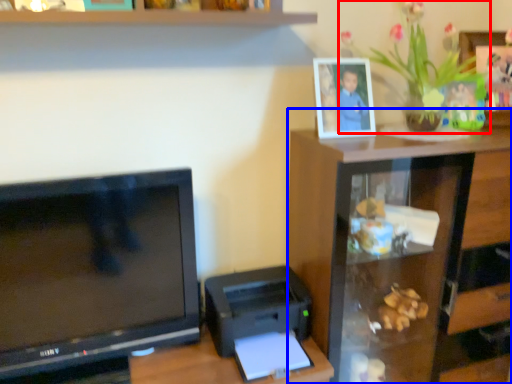
Question: Which point is further to the camera, houseplant (highlighted by a red box) or furniture (highlighted by a blue box)?

Choices:
 (A) houseplant
 (B) furniture

Answer: (B)